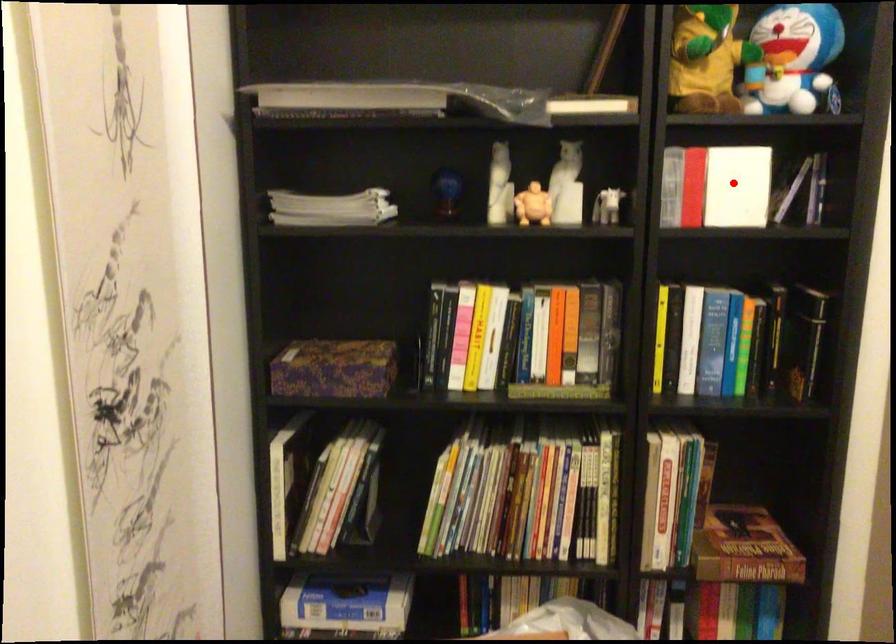
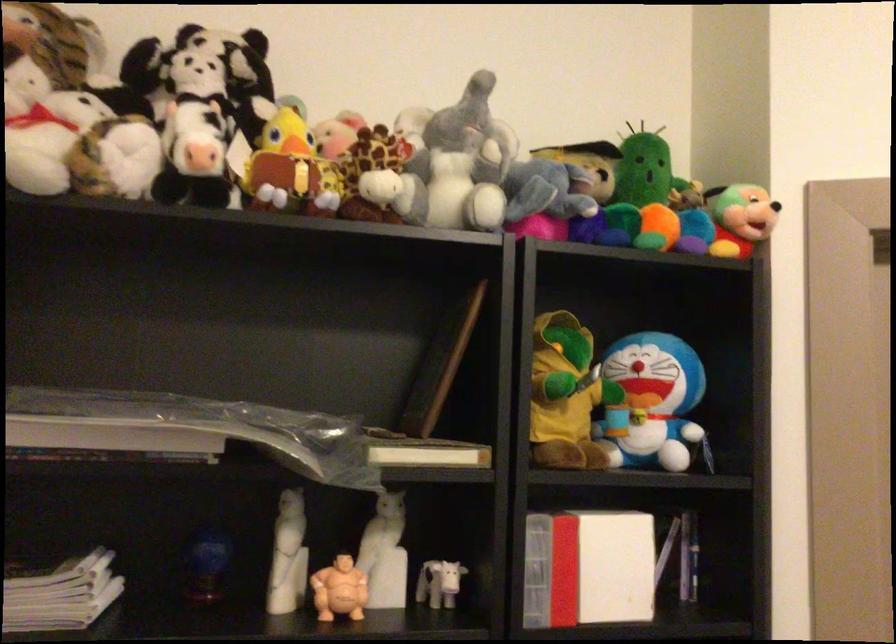
Where in the second image is the point corresponding to the highlighted location from the first image?

(609, 565)